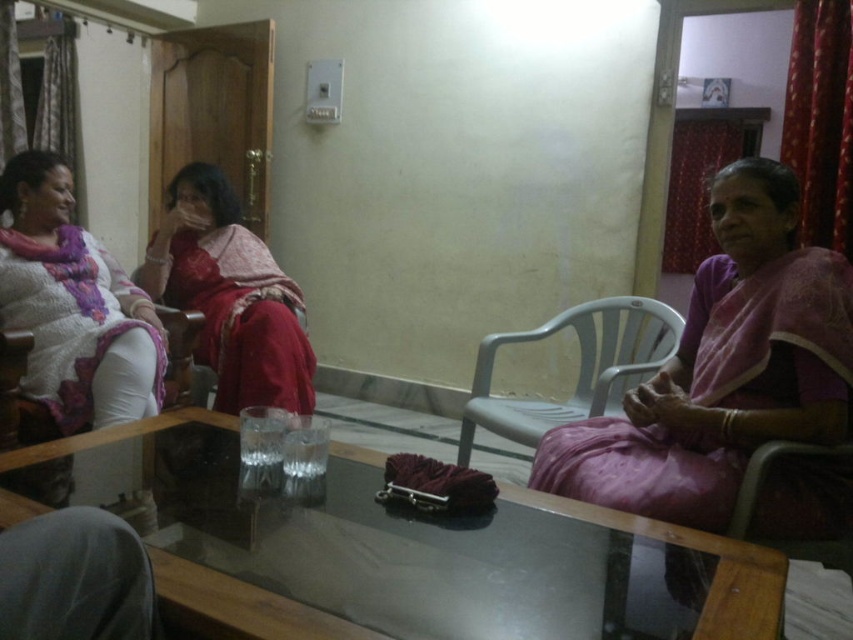
Question: Among these objects, which one is farthest from the camera?

Choices:
 (A) wooden chair at center
 (B) purple silk saree at right
 (C) matte pink saree at center
 (D) matte white pants at left

Answer: (C)

Question: Can you confirm if transparent glass table at center is positioned above matte white pants at left?

Choices:
 (A) yes
 (B) no

Answer: (B)

Question: Can you confirm if plastic chair at right is positioned below wooden chair at center?

Choices:
 (A) no
 (B) yes

Answer: (B)

Question: Which of the following is the closest to the observer?

Choices:
 (A) (90, 330)
 (B) (763, 525)
 (C) (563, 310)

Answer: (B)

Question: Is purple silk saree at right below plastic chair at right?

Choices:
 (A) no
 (B) yes

Answer: (B)

Question: Which object appears farthest from the camera in this image?

Choices:
 (A) purple silk saree at right
 (B) transparent glass table at center
 (C) matte pink saree at center

Answer: (C)